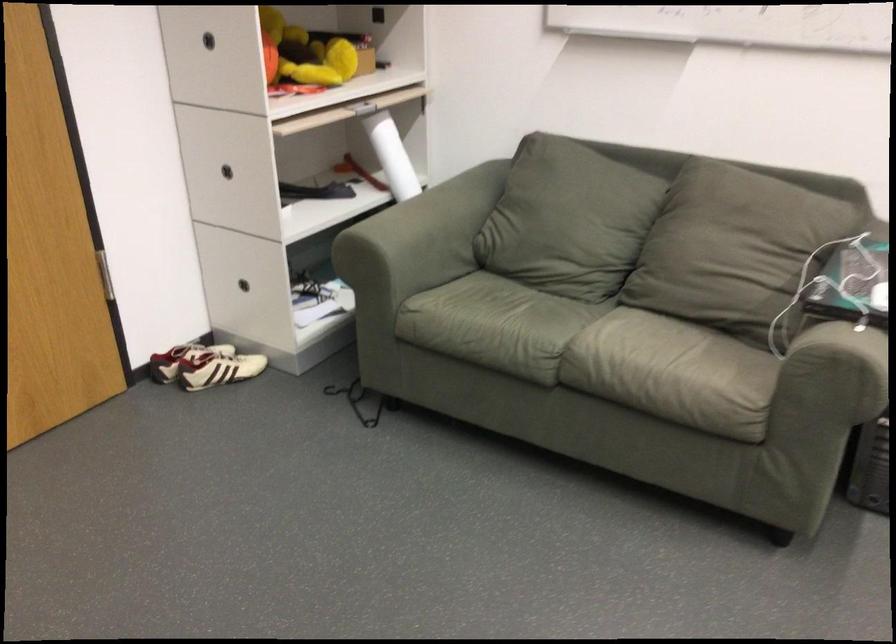
You are a GUI agent. You are given a task and a screenshot of the screen. Output one action in this format:
    pyautogui.click(x=<x>, y=<y>)
    Task: Click on the white rolled paper
    The height and width of the screenshot is (644, 896).
    Given the screenshot: What is the action you would take?
    pyautogui.click(x=392, y=156)